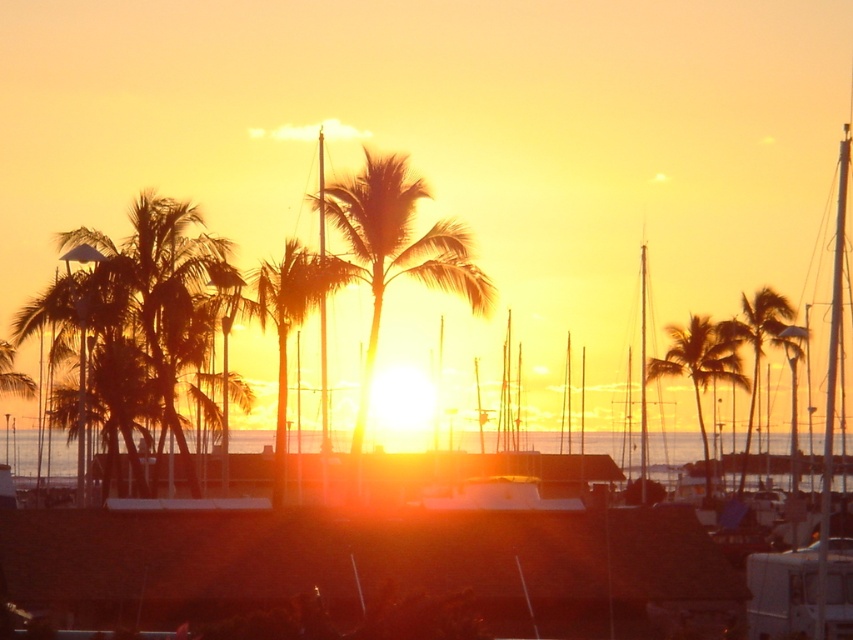
You are a photographer trying to capture the sunset scene. You want to ensure both the silhouette leafy palm at center and the silky gold palm tree at right are visible in your photo. Based on their positions, which palm tree will appear closer to the camera in the final image?

The silhouette leafy palm at center will appear closer to the camera because it is in front of the silky gold palm tree at right.

You are an artist trying to paint the sunset scene. You have two palm trees in front of you, the silky brown palm tree at center and the silhouette leafy palm at center. Which palm tree should you paint as narrower in your painting?

The silky brown palm tree at center should be painted as narrower because its width is less than the silhouette leafy palm at center.

In the scene shown: You are standing at the edge of the marina looking out towards the sunset. There are two points marked in the scene, one at coordinates point (54,444) and another at point (756,323). Which of these points is closer to you as you stand there?

Point (54,444) is closer to you because it is further to the viewer than point (756,323).